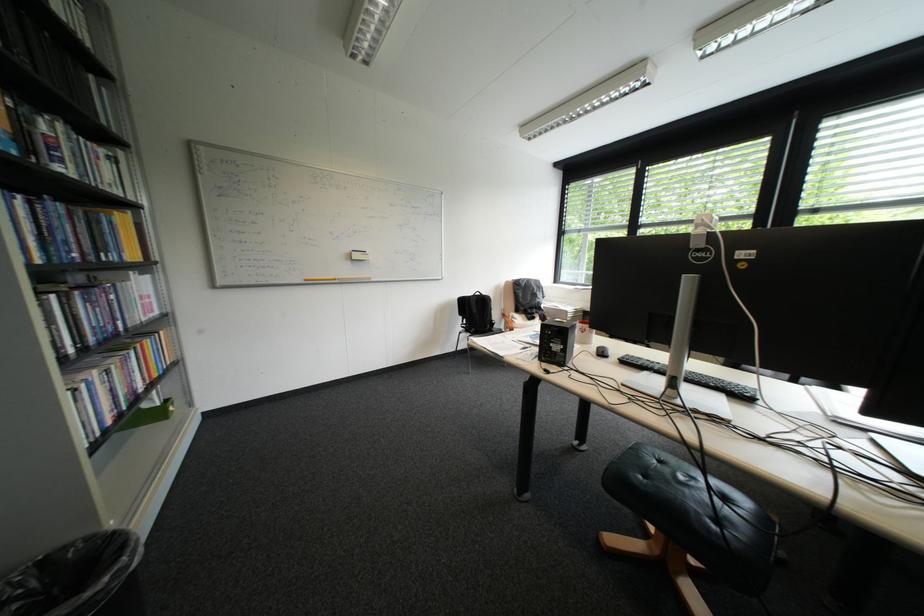
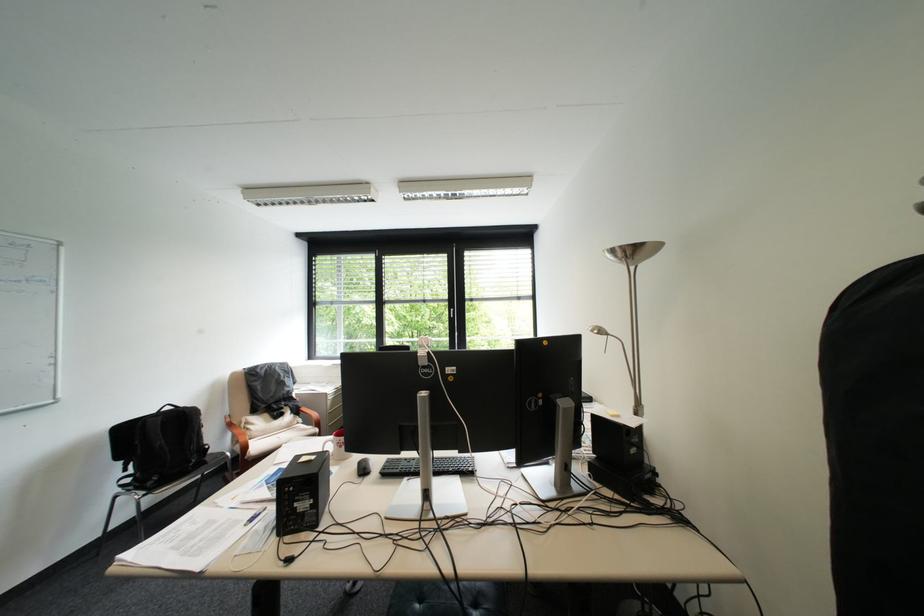
Find the pixel in the second image that matches the point at 608,350 in the first image.

(369, 467)